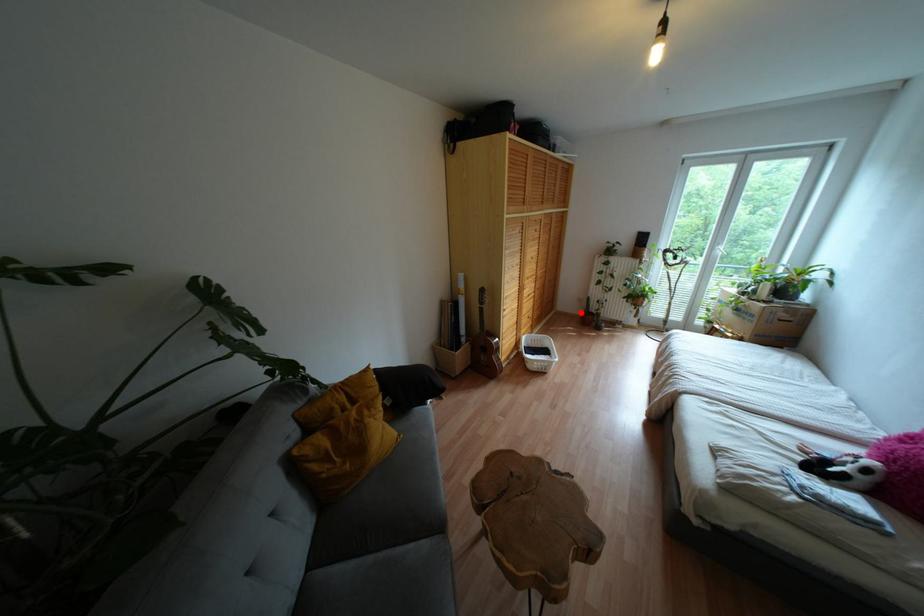
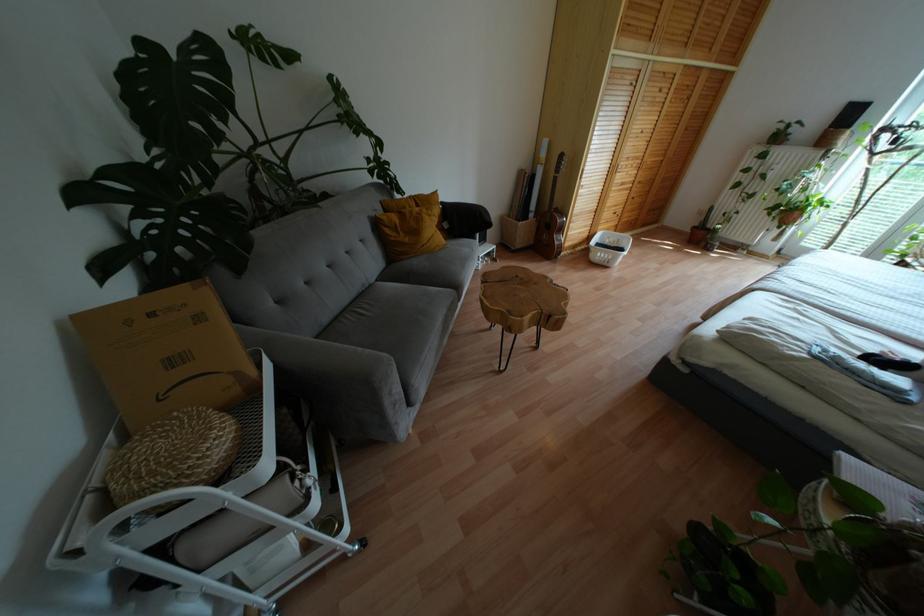
Question: I am providing you with two images of the same scene from different viewpoints. In image1, a red point is highlighted. Considering the same 3D point in image2, which of the following is correct?

Choices:
 (A) It is closer
 (B) It is farther

Answer: (B)